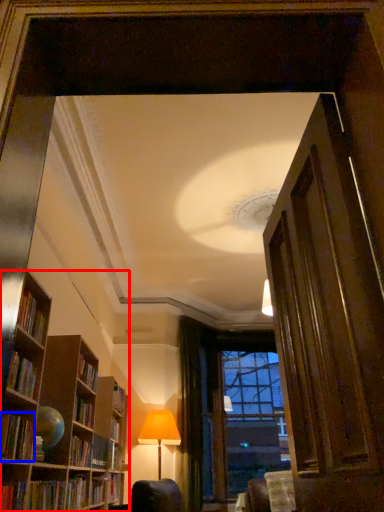
Question: Among these objects, which one is nearest to the camera, bookcase (highlighted by a red box) or book (highlighted by a blue box)?

Choices:
 (A) bookcase
 (B) book

Answer: (A)